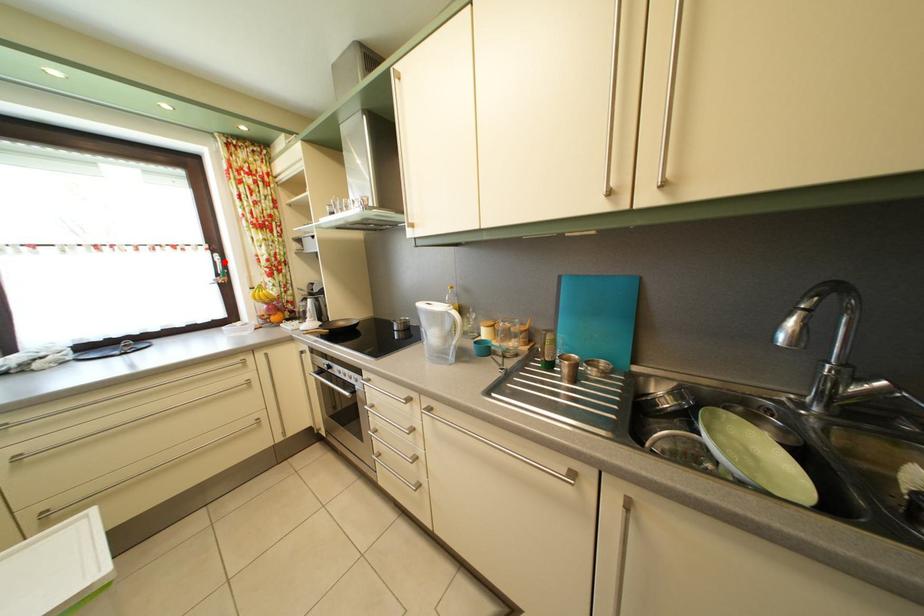
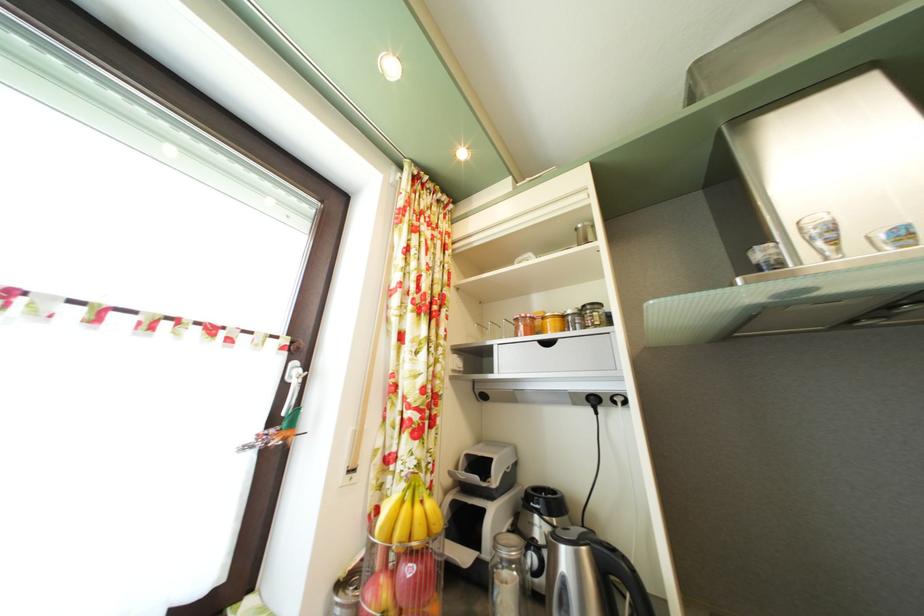
Find the pixel in the second image that matches the highlighted location in the first image.

(304, 371)